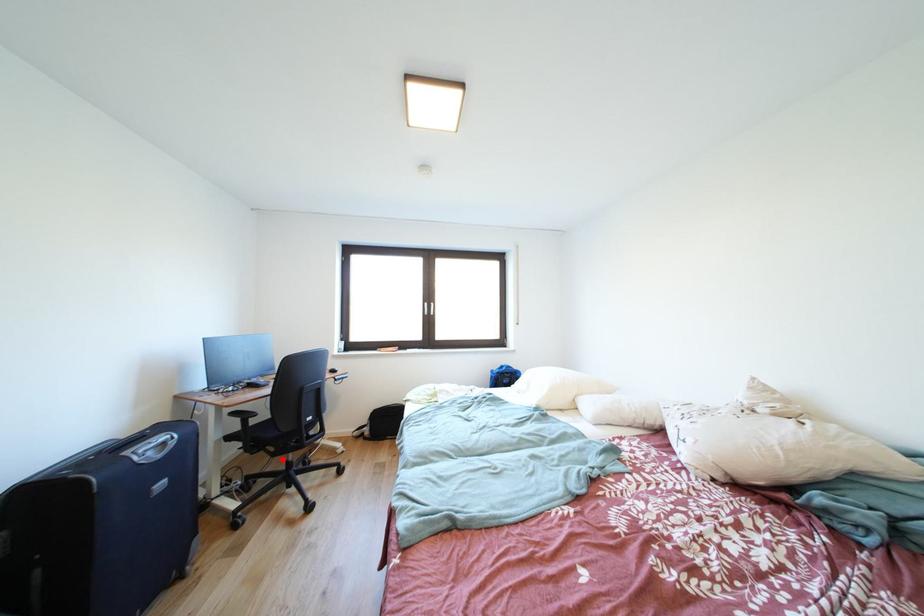
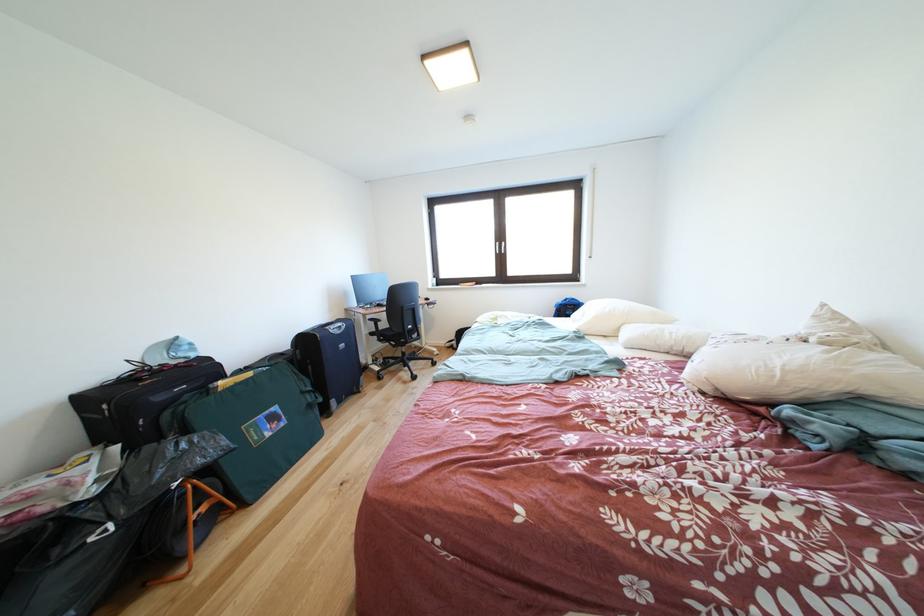
Where in the second image is the point corresponding to the highlighted location from the first image?

(403, 351)